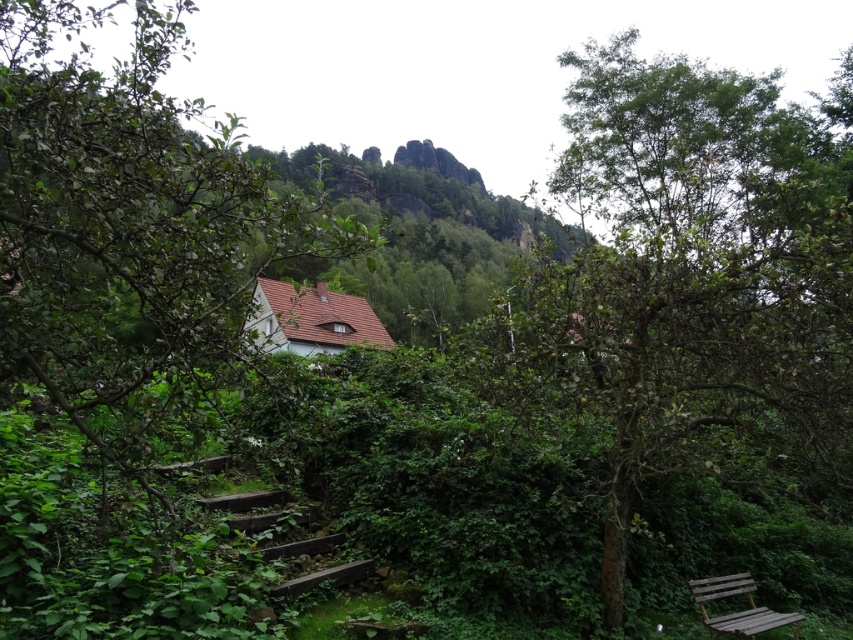
You are planning to place a new bench in your garden. You have a wooden bench at lower right and a green leafy tree at left. Which object is wider?

The green leafy tree at left is wider than the wooden bench at lower right.

Looking at this image, you are a hiker who wants to take a break. You see a green leafy tree at left and a wooden bench at lower right. Which object is taller and would provide more shade?

The green leafy tree at left is much taller than the wooden bench at lower right, so it would provide more shade.